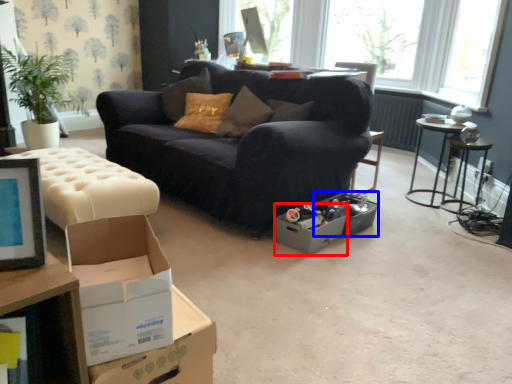
Question: Which object is further to the camera taking this photo, cardboard box (highlighted by a red box) or storage box (highlighted by a blue box)?

Choices:
 (A) cardboard box
 (B) storage box

Answer: (B)